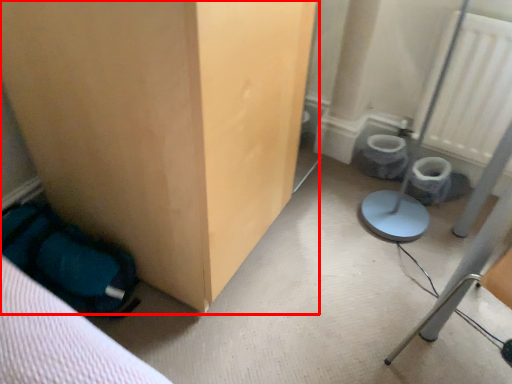
Question: From the image's perspective, what is the correct spatial relationship of furniture (annotated by the red box) in relation to radiator?

Choices:
 (A) above
 (B) below

Answer: (B)